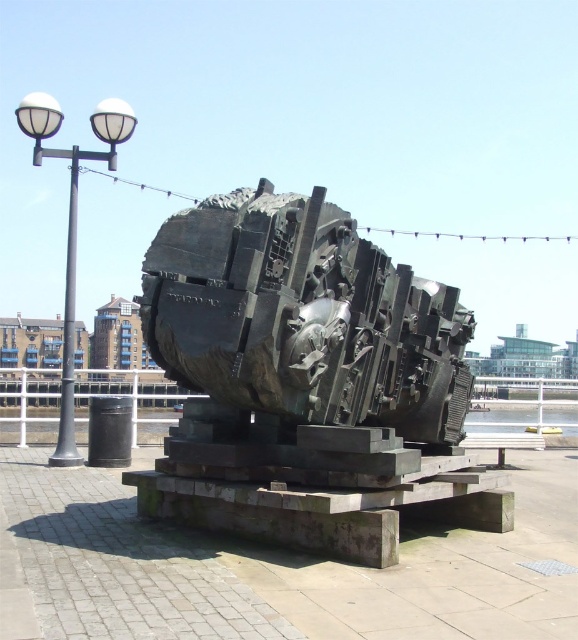
Can you confirm if bronze sculpture at center is wider than white metal lamp post at left?

In fact, bronze sculpture at center might be narrower than white metal lamp post at left.

Does point (228, 376) come farther from viewer compared to point (68, 225)?

No, it is in front of (68, 225).

What are the coordinates of `bronze sculpture at center` in the screenshot? It's located at (301, 323).